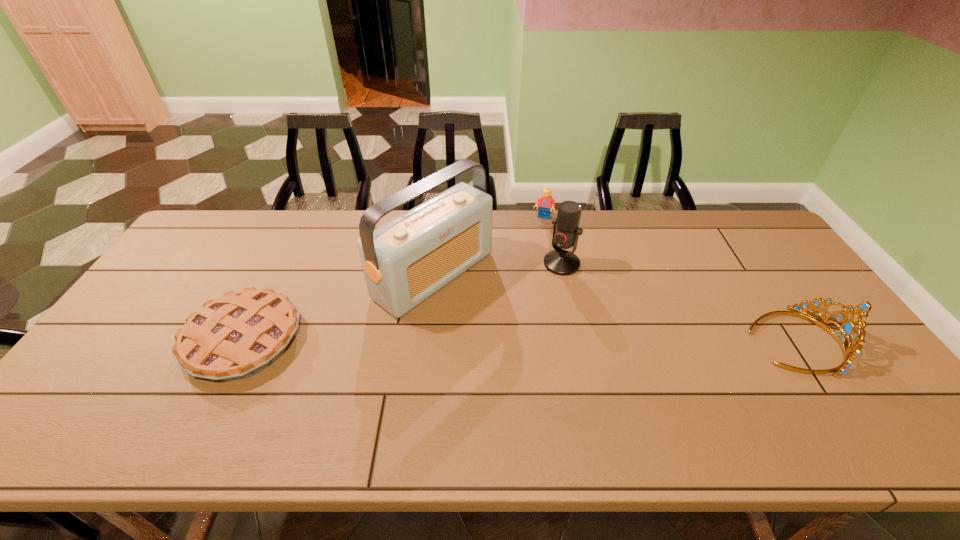
Locate an element on the screen. The image size is (960, 540). vacant region located on the side of the second tallest object with the red ring is located at coordinates (469, 355).

What are the coordinates of `vacant space located on the side of the second tallest object with the red ring` in the screenshot? It's located at (484, 341).

In order to click on blank space located on the side of the second tallest object with the red ring in this screenshot , I will do `click(477, 348)`.

Where is `free space located on the face of the farthest object`? The height and width of the screenshot is (540, 960). free space located on the face of the farthest object is located at coordinates (516, 295).

Find the location of a particular element. vacant space located 0.300m on the face of the farthest object is located at coordinates tap(521, 278).

The image size is (960, 540). In order to click on vacant region located on the face of the farthest object in this screenshot , I will do `click(530, 253)`.

Find the location of a particular element. This screenshot has width=960, height=540. vacant region located on the front-facing side of the tallest object is located at coordinates tap(509, 326).

This screenshot has width=960, height=540. Find the location of `vacant space located on the front-facing side of the tallest object`. vacant space located on the front-facing side of the tallest object is located at coordinates (594, 383).

You are a GUI agent. You are given a task and a screenshot of the screen. Output one action in this format:
    pyautogui.click(x=<x>, y=<y>)
    Task: Click on the free space located 0.150m on the front-facing side of the tallest object
    
    Given the screenshot: What is the action you would take?
    click(x=517, y=332)

Where is `microphone that is at the far edge`? This screenshot has height=540, width=960. microphone that is at the far edge is located at coordinates (566, 232).